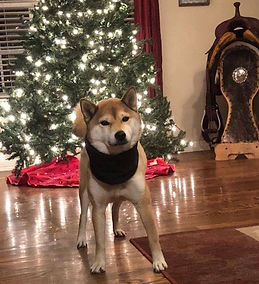
The image size is (259, 284). In order to click on window in this screenshot , I will do `click(12, 56)`.